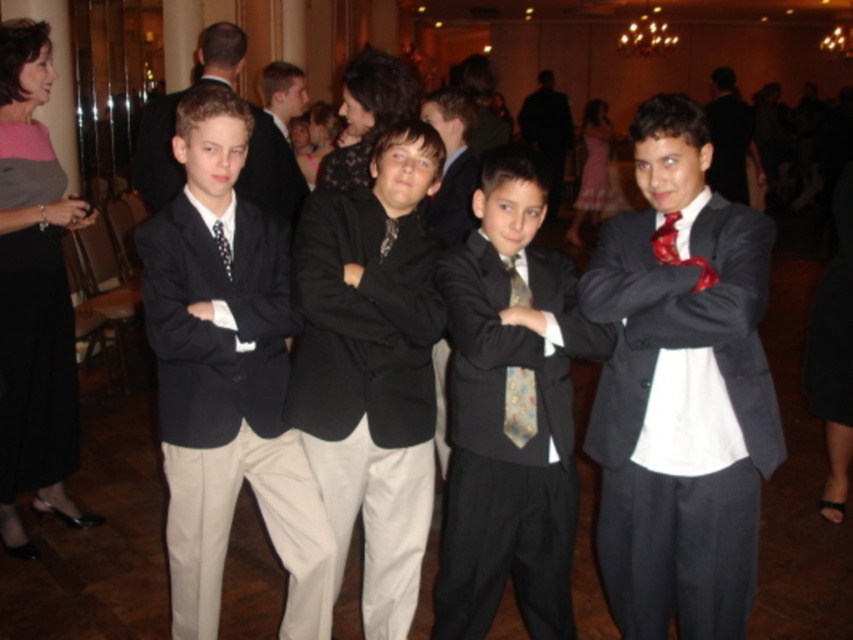
Question: Can you confirm if dark gray suit at right is wider than matte black suit at upper center?

Choices:
 (A) no
 (B) yes

Answer: (B)

Question: Is matte black suit at upper left positioned behind black dotted tie at center?

Choices:
 (A) no
 (B) yes

Answer: (B)

Question: Which point is farther to the camera?

Choices:
 (A) (738, 556)
 (B) (403, 600)
 (C) (605, 173)
 (D) (146, 170)

Answer: (C)

Question: Which of these objects is positioned farthest from the shiny black suit at center?

Choices:
 (A) dark gray suit at right
 (B) silky black tie at center
 (C) black dotted tie at center
 (D) matte black suit at upper right

Answer: (D)

Question: Which point is closer to the camera?

Choices:
 (A) black dotted tie at center
 (B) pink satin dress at center
 (C) matte black dress at left
 (D) shiny black suit at center

Answer: (D)

Question: Is black satin suit at left smaller than black dotted tie at center?

Choices:
 (A) no
 (B) yes

Answer: (A)